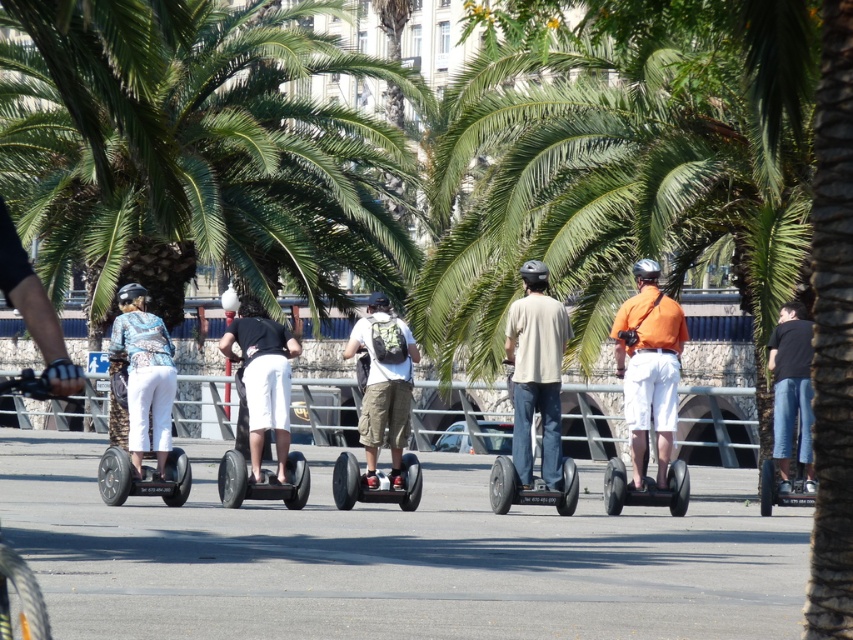
Find the location of a particular element. matte black backpack at center is located at coordinates (383, 385).

Locate an element on the screen. Image resolution: width=853 pixels, height=640 pixels. matte black backpack at center is located at coordinates (383, 385).

Is point (33, 307) farther from viewer compared to point (32, 636)?

Yes, point (33, 307) is behind point (32, 636).

Does point (15, 244) lie in front of point (6, 628)?

That is False.

At what (x,y) coordinates should I click in order to perform the action: click on matte black glove at left. Please return your answer as a coordinate pair (x, y). This screenshot has height=640, width=853. Looking at the image, I should click on (33, 310).

Is matte black glove at left positioned at the back of camouflage-patterned scooter at center-left?

No, it is not.

Find the location of a particular element. The height and width of the screenshot is (640, 853). matte black glove at left is located at coordinates (33, 310).

Is point (13, 305) positioned behind point (119, 428)?

No, (13, 305) is in front of (119, 428).

Image resolution: width=853 pixels, height=640 pixels. I want to click on matte black glove at left, so click(33, 310).